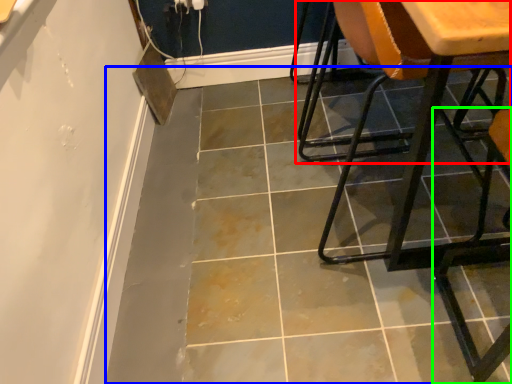
Question: Which is nearer to the chair (highlighted by a red box)? concrete (highlighted by a blue box) or chair (highlighted by a green box).

Choices:
 (A) concrete
 (B) chair

Answer: (A)